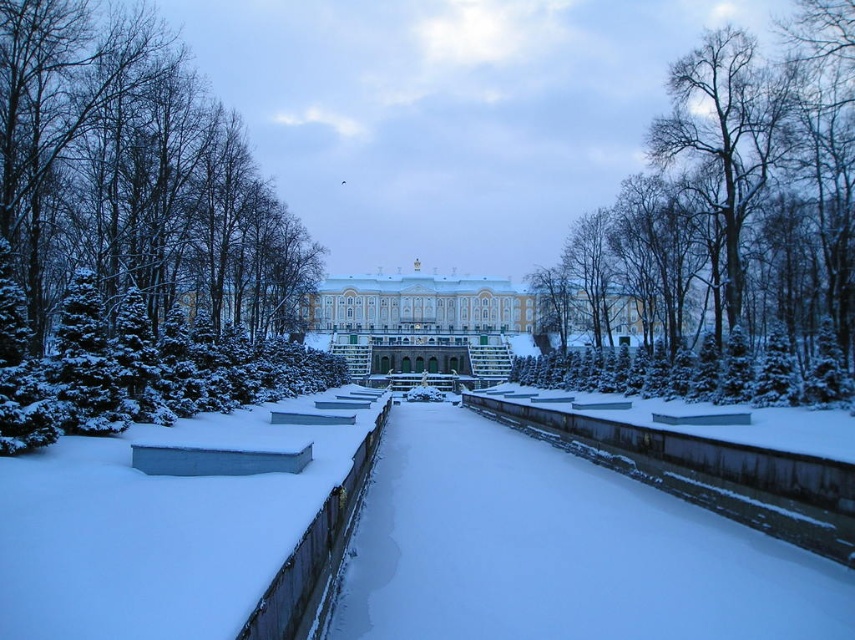
Question: Is bare wood tree at upper right bigger than white stone palace at center?

Choices:
 (A) no
 (B) yes

Answer: (A)

Question: Does snow-covered evergreen tree at center have a greater width compared to bare wood tree at upper right?

Choices:
 (A) no
 (B) yes

Answer: (A)

Question: Estimate the real-world distances between objects in this image. Which object is farther from the bare wood tree at upper right?

Choices:
 (A) snow-covered evergreen tree at center
 (B) white stone palace at center

Answer: (A)

Question: Which point is farther from the camera taking this photo?

Choices:
 (A) (582, 326)
 (B) (716, 296)
 (C) (81, 419)

Answer: (A)

Question: Does snow-covered evergreen tree at center come in front of bare wood tree at upper right?

Choices:
 (A) yes
 (B) no

Answer: (A)

Question: Which point is closer to the camera taking this photo?

Choices:
 (A) (219, 317)
 (B) (410, 289)
 (C) (780, 228)

Answer: (C)